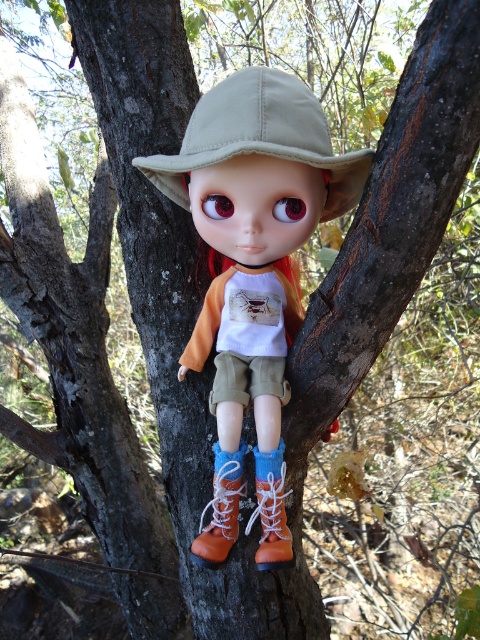
Who is shorter, matte khaki hat at center or orange suede boot at lower center?

orange suede boot at lower center is shorter.

Between point (259, 214) and point (214, 480), which one is positioned behind?

The point (214, 480) is more distant.

The width and height of the screenshot is (480, 640). Find the location of `matte khaki hat at center`. matte khaki hat at center is located at coordinates (252, 272).

Is point (223, 552) more distant than point (264, 506)?

Yes, point (223, 552) is farther from viewer.

Identify the location of orange suede boot at lower center. The image size is (480, 640). (220, 509).

Who is more distant from viewer, (288, 317) or (228, 154)?

The point (288, 317) is more distant.

Looking at this image, does matte khaki hat at center come in front of khaki fabric hat at center?

No, it is behind khaki fabric hat at center.

This screenshot has height=640, width=480. What are the coordinates of `matte khaki hat at center` in the screenshot? It's located at (252, 272).